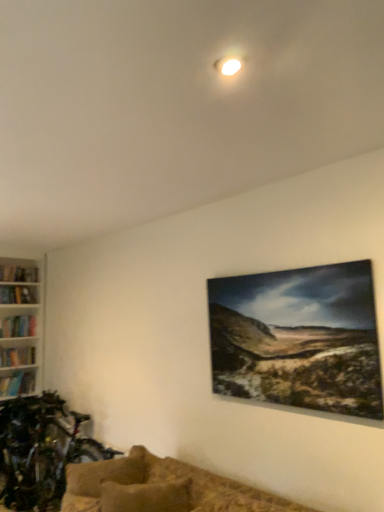
Question: From the image's perspective, is shiny metallic bicycle at lower left below brown textured couch at lower center?

Choices:
 (A) yes
 (B) no

Answer: (A)

Question: Does shiny metallic bicycle at lower left have a greater width compared to brown textured couch at lower center?

Choices:
 (A) no
 (B) yes

Answer: (A)

Question: Can you confirm if shiny metallic bicycle at lower left is bigger than brown textured couch at lower center?

Choices:
 (A) yes
 (B) no

Answer: (A)

Question: From the image's perspective, is shiny metallic bicycle at lower left above brown textured couch at lower center?

Choices:
 (A) no
 (B) yes

Answer: (A)

Question: Could you tell me if shiny metallic bicycle at lower left is turned towards brown textured couch at lower center?

Choices:
 (A) no
 (B) yes

Answer: (A)

Question: Considering the positions of shiny metallic bicycle at lower left and brown textured couch at lower center in the image, is shiny metallic bicycle at lower left wider or thinner than brown textured couch at lower center?

Choices:
 (A) thin
 (B) wide

Answer: (A)

Question: Is shiny metallic bicycle at lower left in front of or behind brown textured couch at lower center in the image?

Choices:
 (A) behind
 (B) front

Answer: (A)

Question: From the image's perspective, is shiny metallic bicycle at lower left positioned above or below brown textured couch at lower center?

Choices:
 (A) below
 (B) above

Answer: (A)

Question: From a real-world perspective, is shiny metallic bicycle at lower left positioned above or below brown textured couch at lower center?

Choices:
 (A) below
 (B) above

Answer: (A)

Question: Based on their sizes in the image, would you say textured beige pillow at lower center is bigger or smaller than brown textured couch at lower center?

Choices:
 (A) big
 (B) small

Answer: (B)

Question: From the image's perspective, is textured beige pillow at lower center located above or below brown textured couch at lower center?

Choices:
 (A) below
 (B) above

Answer: (B)

Question: Considering the relative positions of textured beige pillow at lower center and brown textured couch at lower center in the image provided, is textured beige pillow at lower center to the left or to the right of brown textured couch at lower center?

Choices:
 (A) left
 (B) right

Answer: (B)

Question: In terms of width, does textured beige pillow at lower center look wider or thinner when compared to brown textured couch at lower center?

Choices:
 (A) thin
 (B) wide

Answer: (A)

Question: From the image's perspective, relative to shiny metallic bicycle at lower left, is brown textured couch at lower center above or below?

Choices:
 (A) below
 (B) above

Answer: (B)

Question: Considering the positions of brown textured couch at lower center and shiny metallic bicycle at lower left in the image, is brown textured couch at lower center bigger or smaller than shiny metallic bicycle at lower left?

Choices:
 (A) small
 (B) big

Answer: (A)